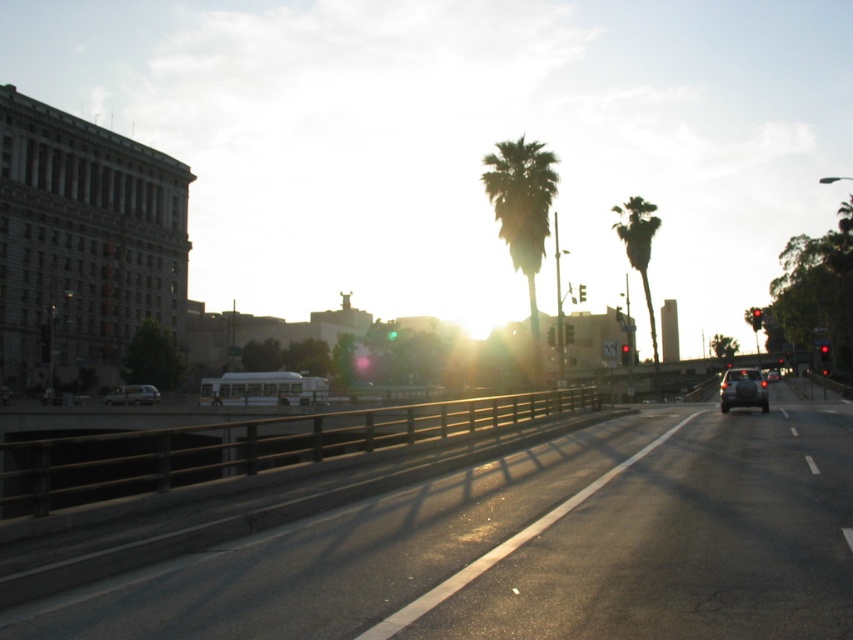
Question: From the image, what is the correct spatial relationship of green leafy palm tree at upper right in relation to matte silver van at left?

Choices:
 (A) below
 (B) above

Answer: (B)

Question: Can you confirm if metallic silver sedan at center is positioned below matte silver van at left?

Choices:
 (A) no
 (B) yes

Answer: (A)

Question: Which point is farther to the camera?

Choices:
 (A) (724, 406)
 (B) (605, 560)

Answer: (A)

Question: Which object is positioned closest to the matte silver van at left?

Choices:
 (A) silhouette leafy palm at center
 (B) black asphalt highway at center
 (C) green leafy palm tree at upper right

Answer: (A)

Question: Does silhouette leafy palm at center have a smaller size compared to matte black suv at center?

Choices:
 (A) yes
 (B) no

Answer: (B)

Question: Which point is closer to the camera?

Choices:
 (A) matte black suv at center
 (B) silhouette leafy palm at center

Answer: (B)